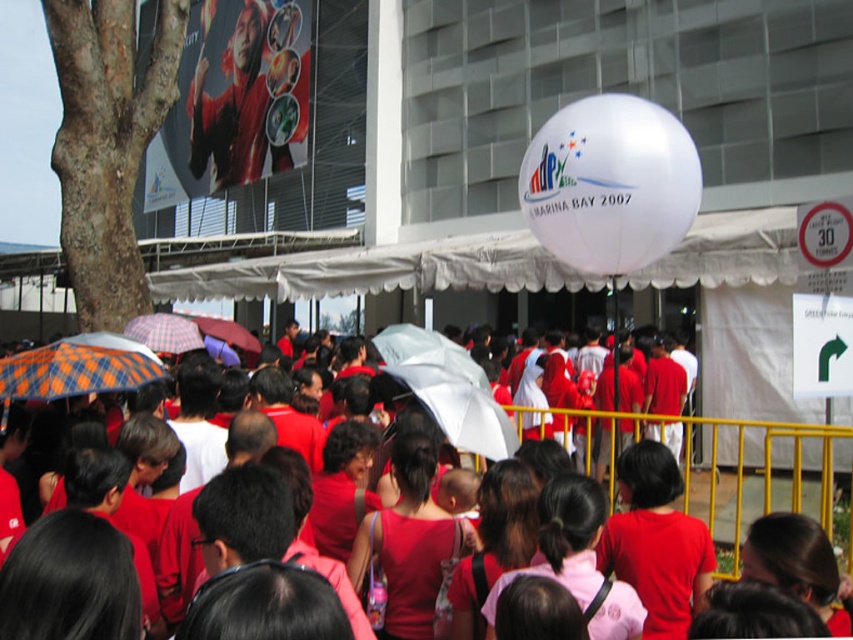
Is matte red shirts at center closer to the viewer compared to orange plaid fabric umbrella at lower left?

No, it is not.

The height and width of the screenshot is (640, 853). I want to click on matte red shirts at center, so click(769, 465).

Consider the image. Does orange plaid fabric umbrella at lower left have a larger size compared to matte purple umbrella at center?

Incorrect, orange plaid fabric umbrella at lower left is not larger than matte purple umbrella at center.

Which is behind, point (61, 378) or point (213, 321)?

Positioned behind is point (213, 321).

Locate an element on the screen. orange plaid fabric umbrella at lower left is located at coordinates (78, 368).

Who is more forward, [450,371] or [223,333]?

Point [450,371] is more forward.

Can you confirm if white matte umbrella at center is wider than matte purple umbrella at center?

In fact, white matte umbrella at center might be narrower than matte purple umbrella at center.

Who is more forward, (453, 429) or (236, 344)?

Point (453, 429)

Find the location of a particular element. This screenshot has height=640, width=853. white matte umbrella at center is located at coordinates (459, 410).